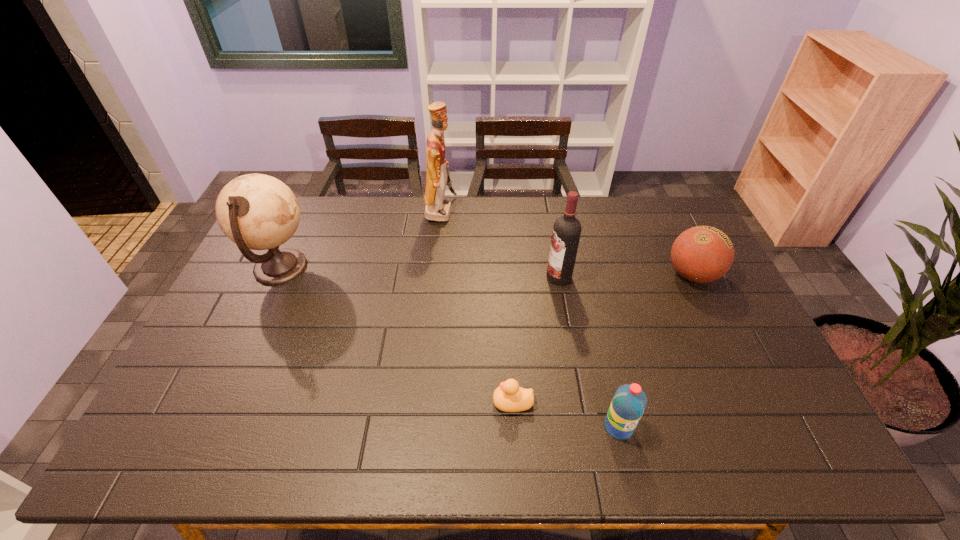
Locate an element on the screen. vacant space located on the label of the wine bottle is located at coordinates (521, 277).

Where is `vacant space located on the label of the wine bottle`? The height and width of the screenshot is (540, 960). vacant space located on the label of the wine bottle is located at coordinates (463, 277).

This screenshot has width=960, height=540. I want to click on free space located on the label of the wine bottle, so click(471, 277).

What are the coordinates of `vacant space located on the left of the basketball` in the screenshot? It's located at (563, 275).

Where is `free point located on the face of the fourth object from right to left`? This screenshot has width=960, height=540. free point located on the face of the fourth object from right to left is located at coordinates (417, 402).

This screenshot has height=540, width=960. In order to click on free space located on the face of the fourth object from right to left in this screenshot , I will do `click(349, 402)`.

Where is `free location located on the face of the fourth object from right to left`? free location located on the face of the fourth object from right to left is located at coordinates (421, 402).

At what (x,y) coordinates should I click in order to perform the action: click on object at the far edge. Please return your answer as a coordinate pair (x, y). Looking at the image, I should click on (437, 208).

Locate an element on the screen. The image size is (960, 540). object located in the near edge section of the desktop is located at coordinates (629, 402).

Image resolution: width=960 pixels, height=540 pixels. Find the location of `object that is at the left edge`. object that is at the left edge is located at coordinates (259, 212).